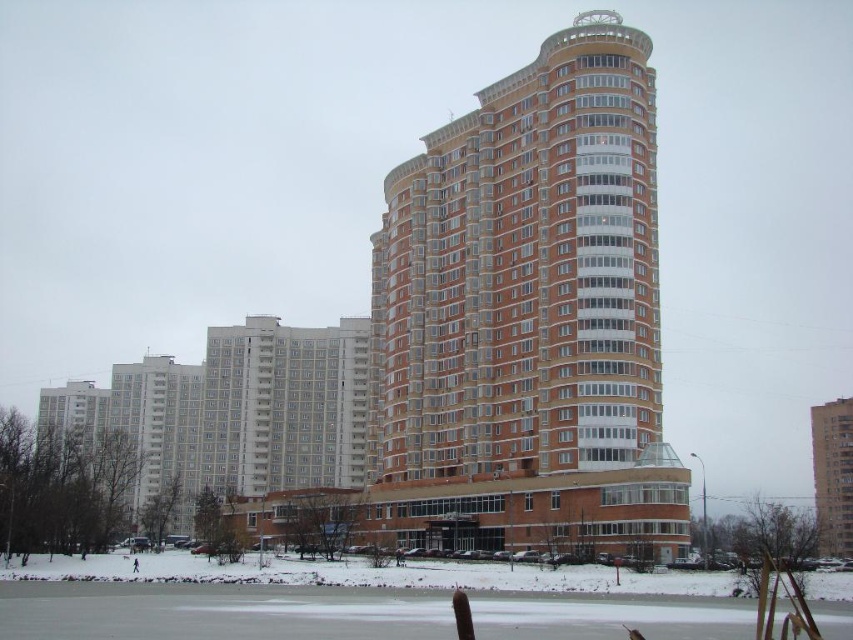
Question: Which object is the farthest from the brick textured building at right?

Choices:
 (A) white smooth building at center
 (B) brown brick building at center

Answer: (A)

Question: Is brown brick building at center to the left of white smooth building at center from the viewer's perspective?

Choices:
 (A) yes
 (B) no

Answer: (B)

Question: Can you confirm if brown brick building at center is positioned above white smooth building at center?

Choices:
 (A) yes
 (B) no

Answer: (A)

Question: Among these points, which one is nearest to the camera?

Choices:
 (A) (822, 458)
 (B) (683, 492)

Answer: (B)

Question: Which object is farther from the camera taking this photo?

Choices:
 (A) white smooth building at center
 (B) brick textured building at right
 (C) brown brick building at center

Answer: (A)

Question: Is brown brick building at center wider than brick textured building at right?

Choices:
 (A) no
 (B) yes

Answer: (A)